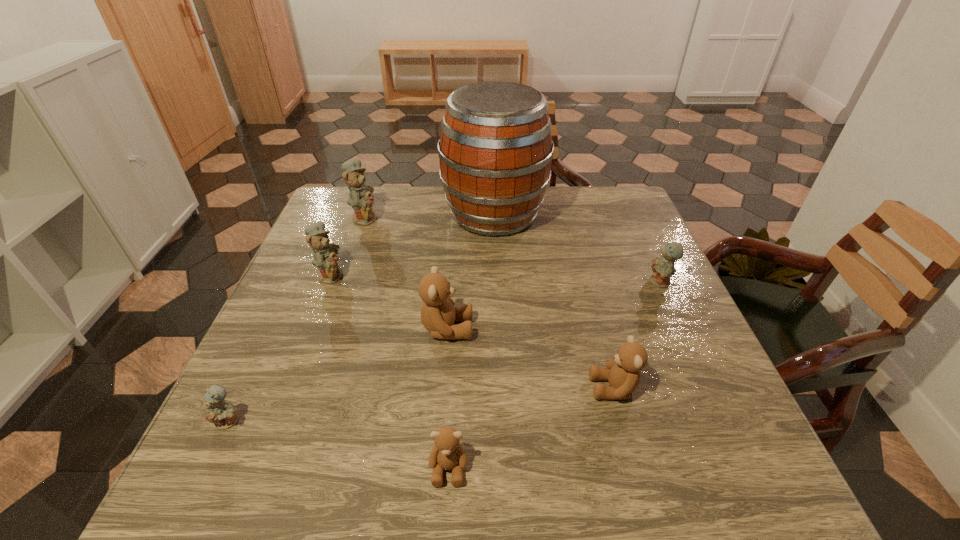
Find the location of `blue teddy bear object that ranks as the second closest to the rightmost object`. blue teddy bear object that ranks as the second closest to the rightmost object is located at coordinates (325, 258).

Identify the location of blue teddy bear that is the fourth closest to the nearest teddy bear. This screenshot has height=540, width=960. (360, 198).

Locate an element on the screen. This screenshot has height=540, width=960. brown teddy bear that is the second nearest to the second smallest brown teddy bear is located at coordinates (447, 453).

Locate an element on the screen. This screenshot has height=540, width=960. brown teddy bear that is the closest to the tallest object is located at coordinates (438, 314).

At what (x,y) coordinates should I click in order to perform the action: click on vacant point that satisfies the following two spatial constraints: 1. on the front-facing side of the rightmost object; 2. on the front-facing side of the leftmost object. Please return your answer as a coordinate pair (x, y). The image size is (960, 540). Looking at the image, I should click on (724, 421).

Image resolution: width=960 pixels, height=540 pixels. In order to click on vacant space that satisfies the following two spatial constraints: 1. on the front-facing side of the farthest teddy bear; 2. on the front-facing side of the smallest blue teddy bear in this screenshot , I will do `click(293, 421)`.

Identify the location of free point that satisfies the following two spatial constraints: 1. on the front side of the tallest object; 2. on the front-facing side of the second biggest blue teddy bear. Image resolution: width=960 pixels, height=540 pixels. (496, 274).

Where is `free location that satisfies the following two spatial constraints: 1. on the front-facing side of the sixth teddy bear from left to right; 2. on the front-facing side of the nearest brown teddy bear`? The height and width of the screenshot is (540, 960). free location that satisfies the following two spatial constraints: 1. on the front-facing side of the sixth teddy bear from left to right; 2. on the front-facing side of the nearest brown teddy bear is located at coordinates (636, 468).

Identify the location of blank area in the image that satisfies the following two spatial constraints: 1. on the front-facing side of the second biggest brown teddy bear; 2. on the front-facing side of the smallest brown teddy bear. The width and height of the screenshot is (960, 540). (636, 468).

Locate an element on the screen. This screenshot has height=540, width=960. vacant space that satisfies the following two spatial constraints: 1. on the front-facing side of the farthest teddy bear; 2. on the front-facing side of the smallest blue teddy bear is located at coordinates 293,421.